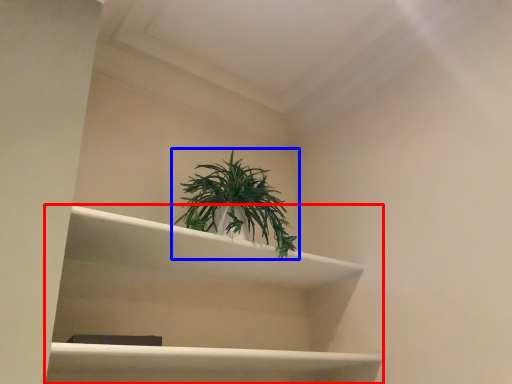
Question: Which point is further to the camera, shelf (highlighted by a red box) or houseplant (highlighted by a blue box)?

Choices:
 (A) shelf
 (B) houseplant

Answer: (B)